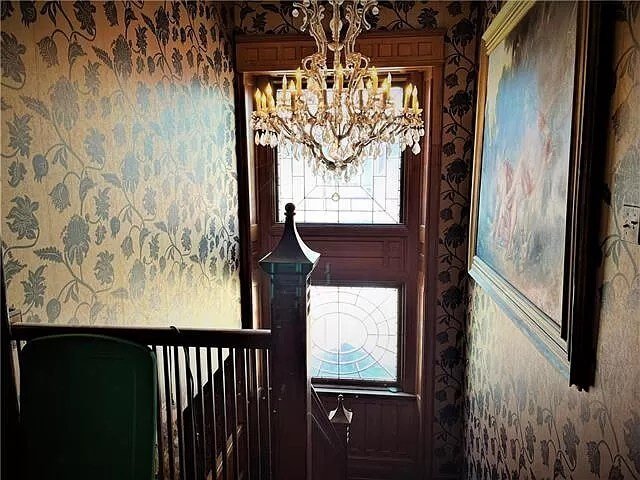
Locate an element on the screen. light switch is located at coordinates (630, 230).